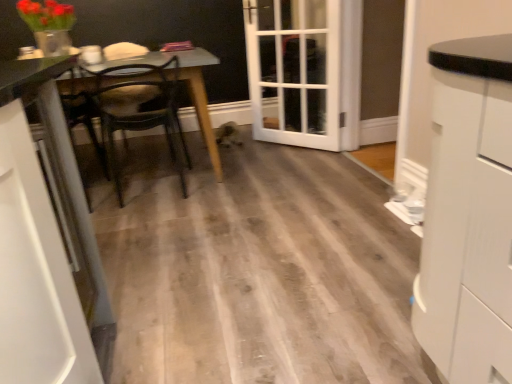
Question: Considering the relative sizes of white glass door at center and wooden table at left in the image provided, is white glass door at center wider than wooden table at left?

Choices:
 (A) yes
 (B) no

Answer: (B)

Question: Is white glass door at center looking in the opposite direction of wooden table at left?

Choices:
 (A) no
 (B) yes

Answer: (A)

Question: Is white glass door at center closer to the viewer compared to wooden table at left?

Choices:
 (A) yes
 (B) no

Answer: (B)

Question: Is white glass door at center further to camera compared to wooden table at left?

Choices:
 (A) yes
 (B) no

Answer: (A)

Question: Would you say white glass door at center is a long distance from wooden table at left?

Choices:
 (A) no
 (B) yes

Answer: (A)

Question: Considering the relative positions of wooden table at left and wooden chair at center in the image provided, is wooden table at left to the left or to the right of wooden chair at center?

Choices:
 (A) right
 (B) left

Answer: (B)

Question: From the image's perspective, is wooden table at left located above or below wooden chair at center?

Choices:
 (A) below
 (B) above

Answer: (B)

Question: Would you say wooden table at left is inside or outside wooden chair at center?

Choices:
 (A) inside
 (B) outside

Answer: (B)

Question: Looking at their shapes, would you say wooden table at left is wider or thinner than wooden chair at center?

Choices:
 (A) wide
 (B) thin

Answer: (A)

Question: From the image's perspective, is white glossy cabinet at left, which ranks as the second cabinetry in right-to-left order, located above or below white matte cabinet at right, which is the second cabinetry from left to right?

Choices:
 (A) above
 (B) below

Answer: (B)

Question: In the image, is white glossy cabinet at left, which ranks as the second cabinetry in right-to-left order, positioned in front of or behind white matte cabinet at right, arranged as the first cabinetry when viewed from the right?

Choices:
 (A) behind
 (B) front

Answer: (A)

Question: From a real-world perspective, is white glossy cabinet at left, arranged as the 1th cabinetry when viewed from the left, physically located above or below white matte cabinet at right, which is the second cabinetry from left to right?

Choices:
 (A) below
 (B) above

Answer: (A)

Question: From their relative heights in the image, would you say white glossy cabinet at left, which ranks as the second cabinetry in right-to-left order, is taller or shorter than white matte cabinet at right, which is the second cabinetry from left to right?

Choices:
 (A) tall
 (B) short

Answer: (B)

Question: Looking at their shapes, would you say wooden table at left is wider or thinner than white glass door at center?

Choices:
 (A) wide
 (B) thin

Answer: (A)

Question: Does point (99, 64) appear closer or farther from the camera than point (287, 3)?

Choices:
 (A) closer
 (B) farther

Answer: (A)